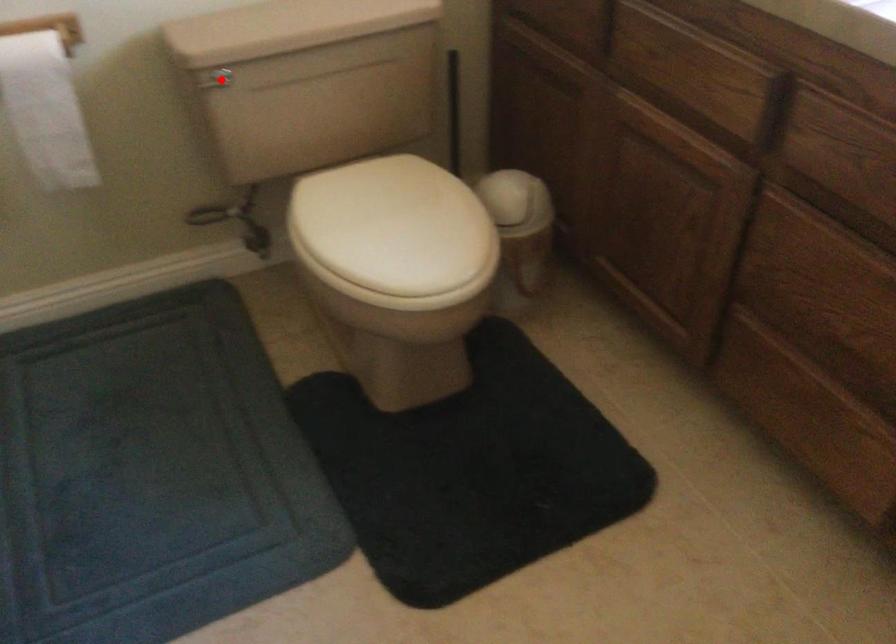
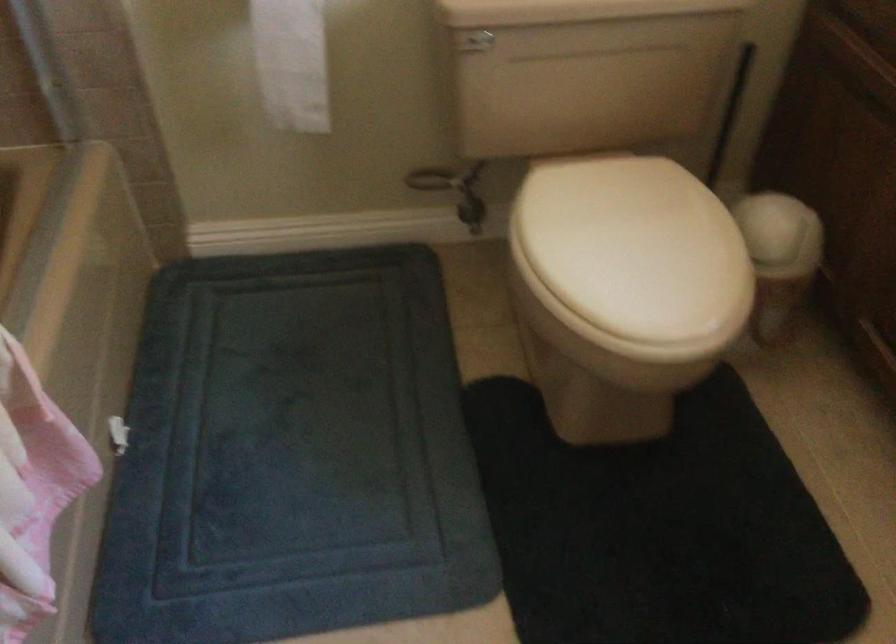
Question: I am providing you with two images of the same scene from different viewpoints. Image1 has a red point marked. In image2, the corresponding 3D location appears at what relative position? Reply with the corresponding letter.

Choices:
 (A) Closer
 (B) Farther

Answer: (A)